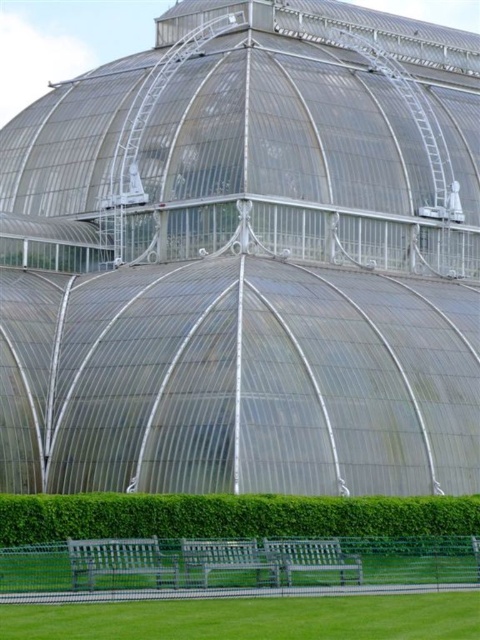
Question: Which object is the farthest from the green metallic bench at lower center?

Choices:
 (A) green leafy hedge at lower center
 (B) green grass football field at lower center
 (C) green wooden bench at lower center

Answer: (A)

Question: Is the position of green grass football field at lower center less distant than that of green wooden bench at lower center?

Choices:
 (A) yes
 (B) no

Answer: (A)

Question: Does green metallic bench at lower center appear on the left side of wooden park bench at lower center?

Choices:
 (A) yes
 (B) no

Answer: (A)

Question: Does green grass football field at lower center come behind green metallic bench at lower center?

Choices:
 (A) yes
 (B) no

Answer: (B)

Question: Among these points, which one is farthest from the camera?

Choices:
 (A) (393, 509)
 (B) (171, 582)

Answer: (A)

Question: Among these objects, which one is farthest from the camera?

Choices:
 (A) green metallic bench at lower center
 (B) green wooden bench at lower center
 (C) wooden park bench at lower center
 (D) green grass football field at lower center

Answer: (C)